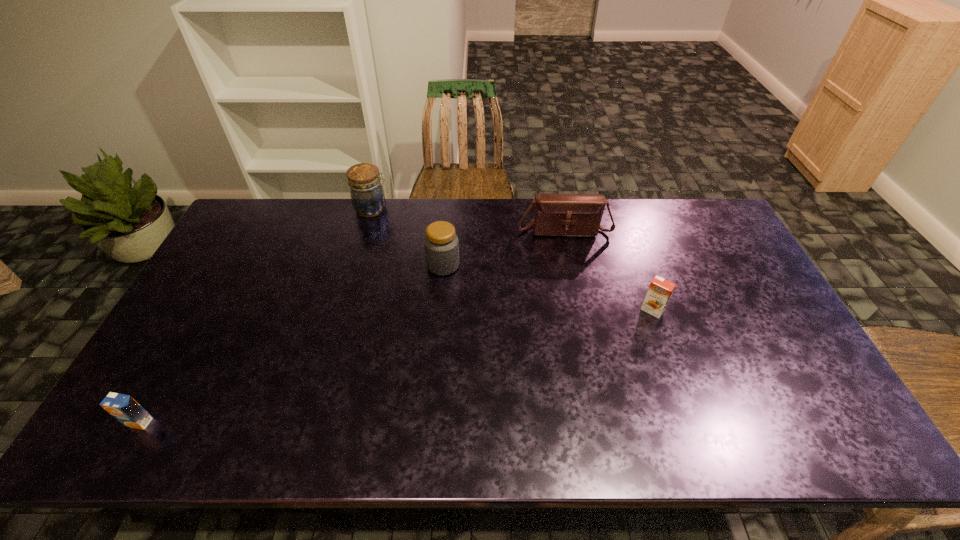
Locate an element on the screen. vacant space located on the lid of the left jar is located at coordinates (404, 208).

Image resolution: width=960 pixels, height=540 pixels. Find the location of `free space located on the front flap of the fourth object from left to right`. free space located on the front flap of the fourth object from left to right is located at coordinates (578, 297).

Where is `vacant space situated on the surface of the right jar near the warning symbol`? This screenshot has height=540, width=960. vacant space situated on the surface of the right jar near the warning symbol is located at coordinates (544, 265).

You are a GUI agent. You are given a task and a screenshot of the screen. Output one action in this format:
    pyautogui.click(x=<x>, y=<y>)
    Task: Click on the free location located 0.350m on the left of the right orange_juice
    
    Given the screenshot: What is the action you would take?
    pyautogui.click(x=520, y=310)

At what (x,y) coordinates should I click in order to perform the action: click on vacant area situated 0.060m on the right of the nearer orange_juice. Please return your answer as a coordinate pair (x, y). Looking at the image, I should click on (177, 422).

Where is `jar located in the far edge section of the desktop`? This screenshot has height=540, width=960. jar located in the far edge section of the desktop is located at coordinates 367,195.

You are a GUI agent. You are given a task and a screenshot of the screen. Output one action in this format:
    pyautogui.click(x=<x>, y=<y>)
    Task: Click on the shoulder bag positioned at the far edge
    Image resolution: width=960 pixels, height=540 pixels.
    Given the screenshot: What is the action you would take?
    pyautogui.click(x=555, y=214)

This screenshot has width=960, height=540. What are the coordinates of `object located at the near edge` in the screenshot? It's located at (124, 408).

You are a GUI agent. You are given a task and a screenshot of the screen. Output one action in this format:
    pyautogui.click(x=<x>, y=<y>)
    Task: Click on the object located in the left edge section of the desktop
    The width and height of the screenshot is (960, 540).
    Given the screenshot: What is the action you would take?
    pyautogui.click(x=124, y=408)

At what (x,y) coordinates should I click in order to perform the action: click on object located in the near left corner section of the desktop. Please return your answer as a coordinate pair (x, y). The height and width of the screenshot is (540, 960). Looking at the image, I should click on (124, 408).